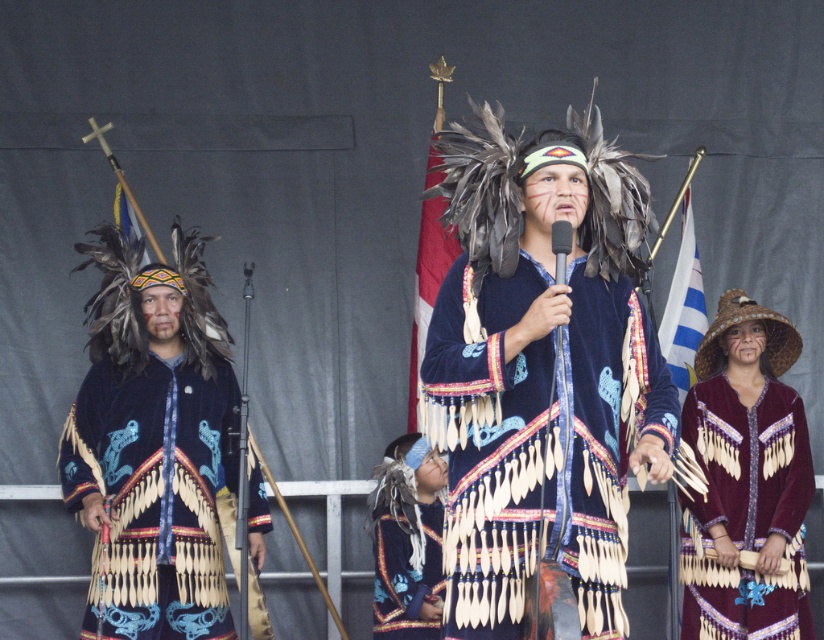
From the picture: Can you confirm if velvet blue headdress at center is taller than maroon velvet dress at lower right?

Indeed, velvet blue headdress at center has a greater height compared to maroon velvet dress at lower right.

Can you confirm if velvet blue headdress at center is thinner than maroon velvet dress at lower right?

No, velvet blue headdress at center is not thinner than maroon velvet dress at lower right.

The image size is (824, 640). I want to click on velvet blue headdress at center, so click(541, 371).

Who is positioned more to the right, velvet blue coat with fringe at left or velvet blue vest at center?

Positioned to the right is velvet blue vest at center.

Locate an element on the screen. velvet blue coat with fringe at left is located at coordinates (153, 442).

Is maroon velvet dress at lower right bigger than velvet blue vest at center?

Yes.

Looking at this image, who is lower down, maroon velvet dress at lower right or velvet blue vest at center?

velvet blue vest at center is lower down.

At what (x,y) coordinates should I click in order to perform the action: click on maroon velvet dress at lower right. Please return your answer as a coordinate pair (x, y). This screenshot has width=824, height=640. Looking at the image, I should click on (747, 480).

What are the coordinates of `maroon velvet dress at lower right` in the screenshot? It's located at (747, 480).